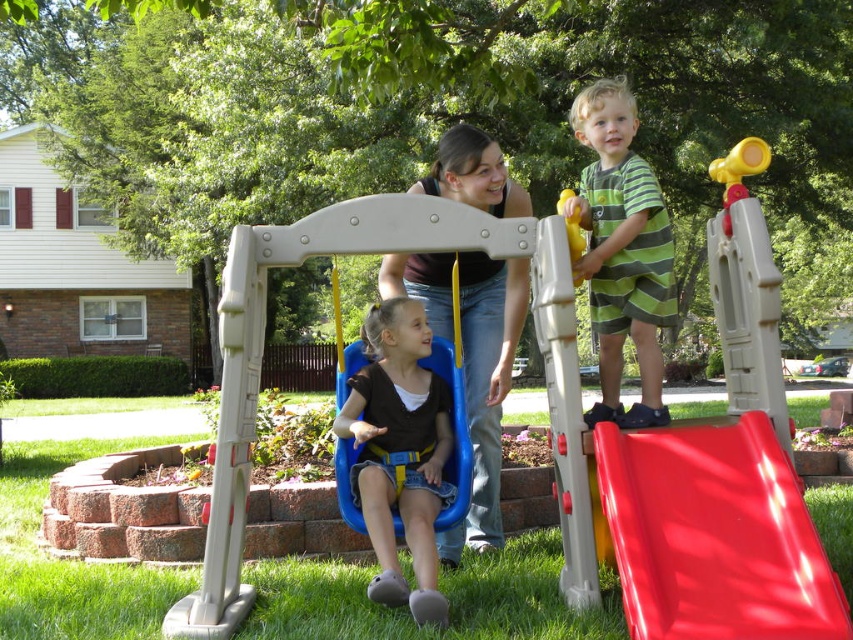
Question: From the image, what is the correct spatial relationship of brown fabric vest at center in relation to yellow plastic handle at upper right?

Choices:
 (A) right
 (B) left

Answer: (B)

Question: Can you confirm if red plastic slide at right is wider than brown fabric vest at center?

Choices:
 (A) yes
 (B) no

Answer: (A)

Question: Among these points, which one is nearest to the camera?

Choices:
 (A) (724, 204)
 (B) (680, 470)

Answer: (B)

Question: Which point is farther from the camera taking this photo?

Choices:
 (A) (747, 141)
 (B) (622, 268)
 (C) (401, 429)
 (D) (776, 472)

Answer: (C)

Question: Which of the following is the closest to the observer?

Choices:
 (A) (722, 218)
 (B) (573, 209)
 (C) (403, 381)

Answer: (B)

Question: Does brown fabric vest at center appear over yellow plastic slide at upper right?

Choices:
 (A) yes
 (B) no

Answer: (B)